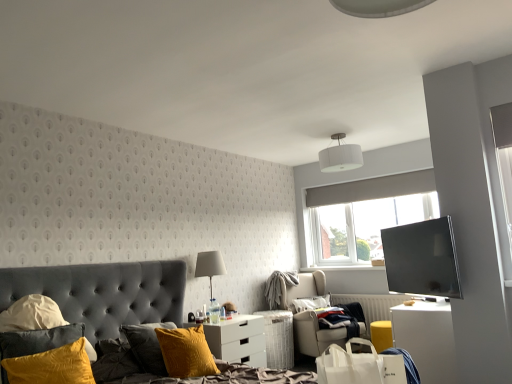
Question: Considering the relative sizes of velvet grey bed at lower left and matte black tv at right in the image provided, is velvet grey bed at lower left taller than matte black tv at right?

Choices:
 (A) yes
 (B) no

Answer: (A)

Question: Is velvet grey bed at lower left shorter than matte black tv at right?

Choices:
 (A) no
 (B) yes

Answer: (A)

Question: Would you say velvet grey bed at lower left is a long distance from matte black tv at right?

Choices:
 (A) no
 (B) yes

Answer: (B)

Question: Is velvet grey bed at lower left behind matte black tv at right?

Choices:
 (A) yes
 (B) no

Answer: (B)

Question: Can you confirm if velvet grey bed at lower left is wider than matte black tv at right?

Choices:
 (A) no
 (B) yes

Answer: (B)

Question: Is velvet grey bed at lower left surrounding matte black tv at right?

Choices:
 (A) no
 (B) yes

Answer: (A)

Question: Considering the relative sizes of white soft pillow at center, which is the first pillow from back to front, and white matte shopping bag at lower right in the image provided, is white soft pillow at center, which is the first pillow from back to front, bigger than white matte shopping bag at lower right?

Choices:
 (A) yes
 (B) no

Answer: (B)

Question: From the image's perspective, is white soft pillow at center, which is the 1th pillow in right-to-left order, below white matte shopping bag at lower right?

Choices:
 (A) yes
 (B) no

Answer: (A)

Question: Is white soft pillow at center, which is the 1th pillow in right-to-left order, outside of white matte shopping bag at lower right?

Choices:
 (A) yes
 (B) no

Answer: (A)

Question: From a real-world perspective, does white soft pillow at center, which is the 1th pillow in right-to-left order, sit lower than white matte shopping bag at lower right?

Choices:
 (A) yes
 (B) no

Answer: (A)

Question: Is white soft pillow at center, which is the 1th pillow in right-to-left order, wider than white matte shopping bag at lower right?

Choices:
 (A) yes
 (B) no

Answer: (B)

Question: Is white matte shopping bag at lower right at the back of white soft pillow at center, arranged as the third pillow when viewed from the front?

Choices:
 (A) no
 (B) yes

Answer: (A)

Question: Can you confirm if white glossy nightstand at lower center is positioned to the left of velvet grey bed at lower left?

Choices:
 (A) yes
 (B) no

Answer: (B)